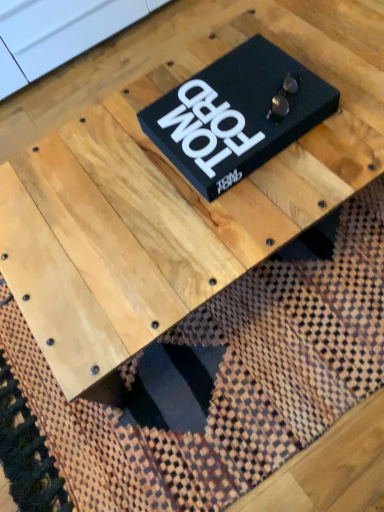
Identify the location of vacant area that is in front of black matte book at center. The width and height of the screenshot is (384, 512). (254, 208).